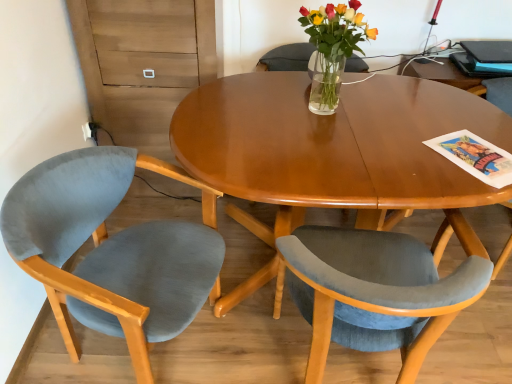
Question: Is velvet blue chair at left, which is the 1th chair from left to right, turned away from blue glossy magazine at upper right?

Choices:
 (A) yes
 (B) no

Answer: (B)

Question: Does velvet blue chair at left, which is the 1th chair from left to right, turn towards blue glossy magazine at upper right?

Choices:
 (A) yes
 (B) no

Answer: (B)

Question: From the image's perspective, does velvet blue chair at left, the 3th chair in the right-to-left sequence, appear higher than blue glossy magazine at upper right?

Choices:
 (A) yes
 (B) no

Answer: (B)

Question: Is the position of velvet blue chair at left, the 3th chair in the right-to-left sequence, more distant than that of blue glossy magazine at upper right?

Choices:
 (A) yes
 (B) no

Answer: (B)

Question: Is the surface of velvet blue chair at left, which is the 1th chair from left to right, in direct contact with blue glossy magazine at upper right?

Choices:
 (A) no
 (B) yes

Answer: (A)

Question: Considering the relative sizes of velvet blue chair at left, which is the 1th chair from left to right, and blue glossy magazine at upper right in the image provided, is velvet blue chair at left, which is the 1th chair from left to right, bigger than blue glossy magazine at upper right?

Choices:
 (A) no
 (B) yes

Answer: (B)

Question: Can you confirm if velvet blue chair at center, which appears as the second chair when viewed from the left, is thinner than clear glass vase at center?

Choices:
 (A) yes
 (B) no

Answer: (B)

Question: Is velvet blue chair at center, which ranks as the second chair in right-to-left order, to the right of clear glass vase at center from the viewer's perspective?

Choices:
 (A) yes
 (B) no

Answer: (A)

Question: Is velvet blue chair at center, which ranks as the second chair in right-to-left order, looking in the opposite direction of clear glass vase at center?

Choices:
 (A) no
 (B) yes

Answer: (A)

Question: Is velvet blue chair at center, which ranks as the second chair in right-to-left order, aimed at clear glass vase at center?

Choices:
 (A) yes
 (B) no

Answer: (B)

Question: Considering the relative sizes of velvet blue chair at center, which ranks as the second chair in right-to-left order, and clear glass vase at center in the image provided, is velvet blue chair at center, which ranks as the second chair in right-to-left order, bigger than clear glass vase at center?

Choices:
 (A) no
 (B) yes

Answer: (B)

Question: From a real-world perspective, is velvet blue chair at center, which appears as the second chair when viewed from the left, positioned under clear glass vase at center based on gravity?

Choices:
 (A) no
 (B) yes

Answer: (B)

Question: From the image's perspective, is clear glass vase at center beneath velvet blue chair at right, placed as the 3th chair when sorted from left to right?

Choices:
 (A) yes
 (B) no

Answer: (B)